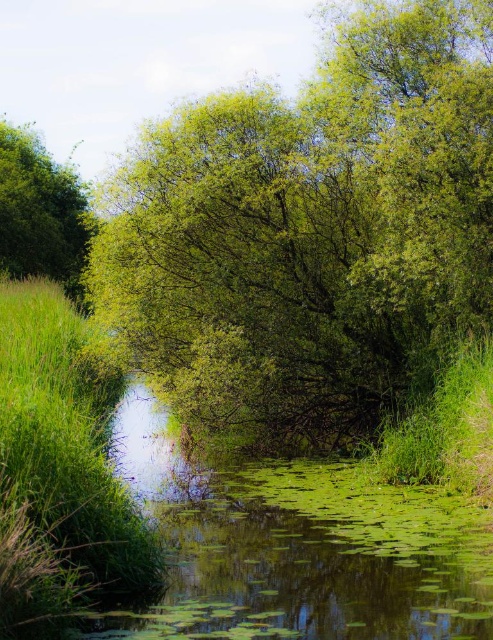
Between point (20, 282) and point (24, 225), which one is positioned behind?

Point (24, 225)

Between green grass at left and green leafy tree at upper left, which one has more height?

With more height is green leafy tree at upper left.

Does point (15, 452) come farther from viewer compared to point (54, 236)?

No.

Identify the location of green grass at left. The image size is (493, 640). (60, 474).

Between green leafy tree at center and green leafy tree at upper left, which one is positioned lower?

Positioned lower is green leafy tree at center.

Does green leafy tree at center appear over green leafy tree at upper left?

No, green leafy tree at center is not above green leafy tree at upper left.

Is point (335, 102) in front of point (7, 211)?

Yes, point (335, 102) is closer to viewer.

You are a GUI agent. You are given a task and a screenshot of the screen. Output one action in this format:
    pyautogui.click(x=<x>, y=<y>)
    Task: Click on the green leafy tree at center
    The image size is (493, 640).
    Given the screenshot: What is the action you would take?
    pyautogui.click(x=312, y=234)

Describe the element at coordinates (312, 234) in the screenshot. I see `green leafy tree at center` at that location.

Who is positioned more to the right, green leafy tree at center or green grass at left?

green leafy tree at center is more to the right.

The height and width of the screenshot is (640, 493). Identify the location of green leafy tree at center. (312, 234).

Find the location of a particular element. Image resolution: width=493 pixels, height=640 pixels. green leafy tree at center is located at coordinates (312, 234).